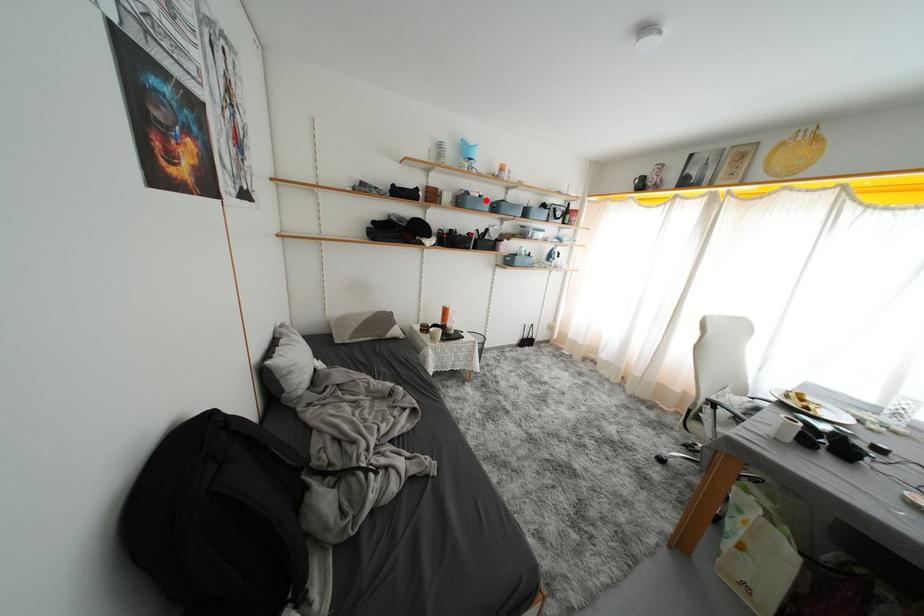
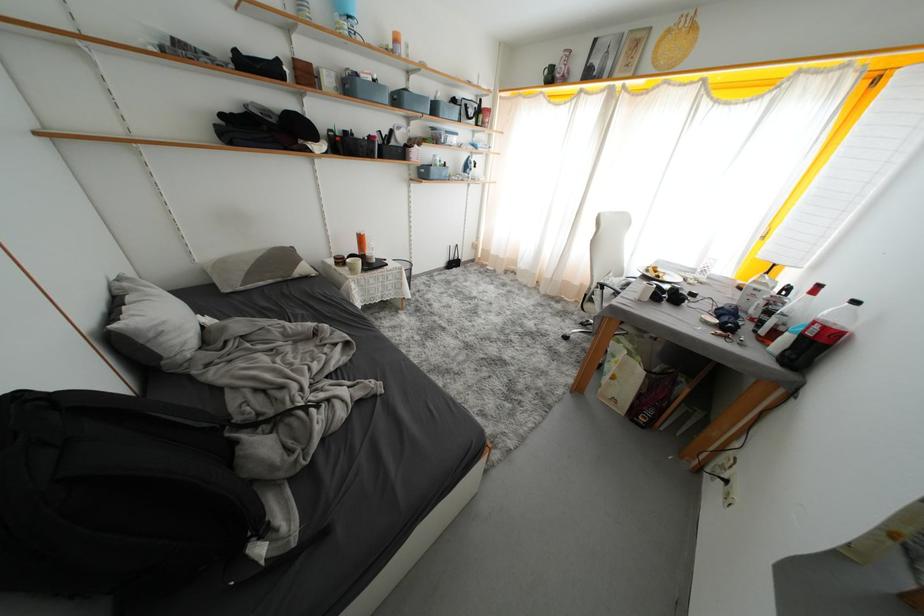
Where in the second image is the point corresponding to the highlighted location from the first image?

(381, 84)